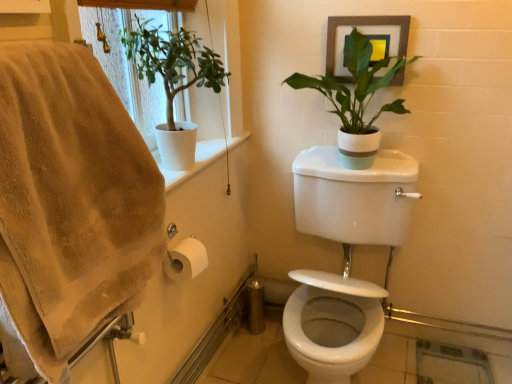
Measure the distance between white matte plant at upper left, positioned as the 2th houseplant in right-to-left order, and camera.

white matte plant at upper left, positioned as the 2th houseplant in right-to-left order, is 1.28 meters from camera.

Where is `white matte plant at upper left, the first houseplant viewed from the left`? This screenshot has height=384, width=512. white matte plant at upper left, the first houseplant viewed from the left is located at coordinates (174, 81).

What is the approximate width of beige cotton bath towel at left?

beige cotton bath towel at left is 4.45 inches in width.

Find the location of a particular element. white matte plant at upper left, positioned as the 2th houseplant in right-to-left order is located at coordinates (174, 81).

Consider the image. Is white matte plant at upper left, the first houseplant viewed from the left, at the back of wooden framed picture at upper right?

No, wooden framed picture at upper right is not facing the opposite direction of white matte plant at upper left, the first houseplant viewed from the left.

Can you confirm if wooden framed picture at upper right is taller than white matte plant at upper left, positioned as the 2th houseplant in right-to-left order?

No.

Is wooden framed picture at upper right to the left or to the right of white matte plant at upper left, positioned as the 2th houseplant in right-to-left order, in the image?

Based on their positions, wooden framed picture at upper right is located to the right of white matte plant at upper left, positioned as the 2th houseplant in right-to-left order.

Which is in front, white glossy toilet at center or white matte plant at upper left, positioned as the 2th houseplant in right-to-left order?

white glossy toilet at center is closer to the camera.

Is point (339, 237) closer or farther from the camera than point (170, 103)?

Point (339, 237) is positioned farther from the camera compared to point (170, 103).

Is white glossy toilet at center turned away from white matte plant at upper left, positioned as the 2th houseplant in right-to-left order?

white glossy toilet at center does not have its back to white matte plant at upper left, positioned as the 2th houseplant in right-to-left order.

Which of these two, white glossy toilet at center or white matte plant at upper left, positioned as the 2th houseplant in right-to-left order, is wider?

white glossy toilet at center.

Considering the points (403, 41) and (352, 121), which point is behind, point (403, 41) or point (352, 121)?

Point (352, 121)

Relative to white matte pot at upper right, which is counted as the 2th houseplant, starting from the left, is wooden framed picture at upper right in front or behind?

In the image, wooden framed picture at upper right appears behind white matte pot at upper right, which is counted as the 2th houseplant, starting from the left.

Is wooden framed picture at upper right thinner than white matte pot at upper right, which is counted as the 2th houseplant, starting from the left?

Yes.

Which object is positioned more to the right, wooden framed picture at upper right or white matte pot at upper right, which is counted as the 2th houseplant, starting from the left?

From the viewer's perspective, wooden framed picture at upper right appears more on the right side.

The width and height of the screenshot is (512, 384). I want to click on bath towel on the left of white matte pot at upper right, which is counted as the first houseplant, starting from the right, so click(x=71, y=200).

Considering the relative sizes of beige cotton bath towel at left and white matte pot at upper right, which is counted as the 2th houseplant, starting from the left, in the image provided, is beige cotton bath towel at left bigger than white matte pot at upper right, which is counted as the 2th houseplant, starting from the left,?

No, beige cotton bath towel at left is not bigger than white matte pot at upper right, which is counted as the 2th houseplant, starting from the left.

Is beige cotton bath towel at left positioned with its back to white matte pot at upper right, which is counted as the first houseplant, starting from the right?

That's not correct — beige cotton bath towel at left is not looking away from white matte pot at upper right, which is counted as the first houseplant, starting from the right.

Which object is closer to the camera, beige cotton bath towel at left or white matte pot at upper right, which is counted as the 2th houseplant, starting from the left?

beige cotton bath towel at left is in front.

Looking at this image, from a real-world perspective, is white matte plant at upper left, positioned as the 2th houseplant in right-to-left order, under white matte pot at upper right, which is counted as the first houseplant, starting from the right?

Actually, white matte plant at upper left, positioned as the 2th houseplant in right-to-left order, is physically above white matte pot at upper right, which is counted as the first houseplant, starting from the right, in the real world.

Is white matte plant at upper left, the first houseplant viewed from the left, oriented towards white matte pot at upper right, which is counted as the first houseplant, starting from the right?

No, white matte plant at upper left, the first houseplant viewed from the left, is not facing towards white matte pot at upper right, which is counted as the first houseplant, starting from the right.

The image size is (512, 384). What are the coordinates of `houseplant in front of the white matte pot at upper right, which is counted as the 2th houseplant, starting from the left` in the screenshot? It's located at (174, 81).

Is white matte plant at upper left, positioned as the 2th houseplant in right-to-left order, completely or partially outside of white matte pot at upper right, which is counted as the 2th houseplant, starting from the left?

Yes.

Is wooden framed picture at upper right positioned with its back to white glossy toilet at center?

No, wooden framed picture at upper right is not facing the opposite direction of white glossy toilet at center.

Can you confirm if wooden framed picture at upper right is taller than white glossy toilet at center?

In fact, wooden framed picture at upper right may be shorter than white glossy toilet at center.

From the picture: Can we say wooden framed picture at upper right lies outside white glossy toilet at center?

Yes, wooden framed picture at upper right is outside of white glossy toilet at center.

Can you confirm if wooden framed picture at upper right is positioned to the right of white glossy toilet at center?

Yes.

How much distance is there between white glossy toilet at center and wooden framed picture at upper right?

The distance of white glossy toilet at center from wooden framed picture at upper right is 44.29 centimeters.

Considering the sizes of objects white glossy toilet at center and wooden framed picture at upper right in the image provided, who is bigger, white glossy toilet at center or wooden framed picture at upper right?

white glossy toilet at center.

Is white glossy toilet at center wider than wooden framed picture at upper right?

Yes.

Does white glossy toilet at center turn towards wooden framed picture at upper right?

No, white glossy toilet at center is not oriented towards wooden framed picture at upper right.

At what (x,y) coordinates should I click in order to perform the action: click on picture frame above the white matte plant at upper left, the first houseplant viewed from the left (from the image's perspective). Please return your answer as a coordinate pair (x, y). The width and height of the screenshot is (512, 384). Looking at the image, I should click on (362, 33).

The image size is (512, 384). What are the coordinates of `sink that is in front of the white matte plant at upper left, positioned as the 2th houseplant in right-to-left order` in the screenshot? It's located at (344, 257).

Based on their spatial positions, is white glossy toilet at center or white matte pot at upper right, which is counted as the first houseplant, starting from the right, further from white matte plant at upper left, positioned as the 2th houseplant in right-to-left order?

Among the two, white glossy toilet at center is located further to white matte plant at upper left, positioned as the 2th houseplant in right-to-left order.

Based on their spatial positions, is wooden framed picture at upper right or beige cotton bath towel at left closer to white glossy toilet at center?

wooden framed picture at upper right is closer to white glossy toilet at center.

From the image, which object appears to be farther from white matte plant at upper left, positioned as the 2th houseplant in right-to-left order, white matte pot at upper right, which is counted as the 2th houseplant, starting from the left, or white glossy toilet at center?

white glossy toilet at center is positioned further to the anchor white matte plant at upper left, positioned as the 2th houseplant in right-to-left order.

Which object lies further to the anchor point white matte plant at upper left, the first houseplant viewed from the left, white matte pot at upper right, which is counted as the 2th houseplant, starting from the left, or beige cotton bath towel at left?

beige cotton bath towel at left is further to white matte plant at upper left, the first houseplant viewed from the left.

Which object lies nearer to the anchor point white glossy toilet at center, beige cotton bath towel at left or white matte pot at upper right, which is counted as the 2th houseplant, starting from the left?

white matte pot at upper right, which is counted as the 2th houseplant, starting from the left, lies closer to white glossy toilet at center than the other object.

From the image, which object appears to be farther from white matte pot at upper right, which is counted as the first houseplant, starting from the right, white matte plant at upper left, the first houseplant viewed from the left, or white glossy toilet at center?

white matte plant at upper left, the first houseplant viewed from the left, is further to white matte pot at upper right, which is counted as the first houseplant, starting from the right.

When comparing their distances from white matte plant at upper left, positioned as the 2th houseplant in right-to-left order, does beige cotton bath towel at left or white matte pot at upper right, which is counted as the first houseplant, starting from the right, seem further?

beige cotton bath towel at left.

Considering their positions, is white matte pot at upper right, which is counted as the 2th houseplant, starting from the left, positioned further to beige cotton bath towel at left than wooden framed picture at upper right?

wooden framed picture at upper right is further to beige cotton bath towel at left.

You are a GUI agent. You are given a task and a screenshot of the screen. Output one action in this format:
    pyautogui.click(x=<x>, y=<y>)
    Task: Click on the houseplant located between white matte plant at upper left, positioned as the 2th houseplant in right-to-left order, and wooden framed picture at upper right in the left-right direction
    Image resolution: width=512 pixels, height=384 pixels.
    Given the screenshot: What is the action you would take?
    pyautogui.click(x=356, y=99)

The image size is (512, 384). I want to click on houseplant between beige cotton bath towel at left and white glossy toilet at center from left to right, so click(174, 81).

This screenshot has width=512, height=384. Identify the location of houseplant between beige cotton bath towel at left and white matte pot at upper right, which is counted as the 2th houseplant, starting from the left, along the z-axis. (174, 81).

I want to click on houseplant between white matte pot at upper right, which is counted as the 2th houseplant, starting from the left, and white glossy toilet at center in the up-down direction, so click(x=174, y=81).